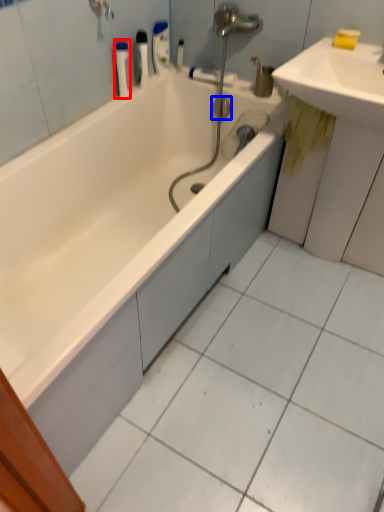
Question: Which object is further to the camera taking this photo, toiletry (highlighted by a red box) or plumbing fixture (highlighted by a blue box)?

Choices:
 (A) toiletry
 (B) plumbing fixture

Answer: (B)